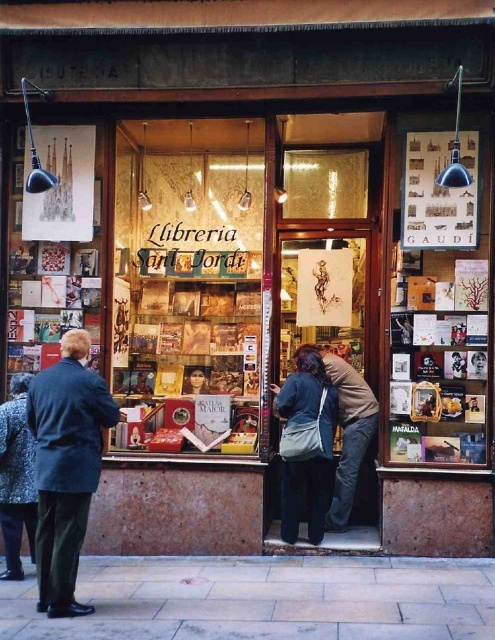
From the picture: Can you confirm if dark blue coat at left is shorter than speckled wool coat at lower left?

No.

Does dark blue coat at left lie in front of speckled wool coat at lower left?

Yes, it is in front of speckled wool coat at lower left.

Does point (76, 426) come farther from viewer compared to point (12, 460)?

No, it is in front of (12, 460).

Where is `dark blue coat at left`? The height and width of the screenshot is (640, 495). dark blue coat at left is located at coordinates (65, 467).

Between dark blue fabric bag at center and speckled wool coat at lower left, which one has less height?

speckled wool coat at lower left

Where is `dark blue fabric bag at center`? dark blue fabric bag at center is located at coordinates (317, 452).

Locate an element on the screen. The width and height of the screenshot is (495, 640). dark blue fabric bag at center is located at coordinates (317, 452).

Is point (157, 296) closer to viewer compared to point (79, 465)?

No, (157, 296) is further to viewer.

This screenshot has width=495, height=640. Describe the element at coordinates (192, 280) in the screenshot. I see `matte glass display case at center` at that location.

Is point (206, 227) positioned after point (49, 600)?

Yes, it is behind point (49, 600).

At what (x,y) coordinates should I click in order to perform the action: click on matte glass display case at center. Please return your answer as a coordinate pair (x, y). This screenshot has width=495, height=640. Looking at the image, I should click on (192, 280).